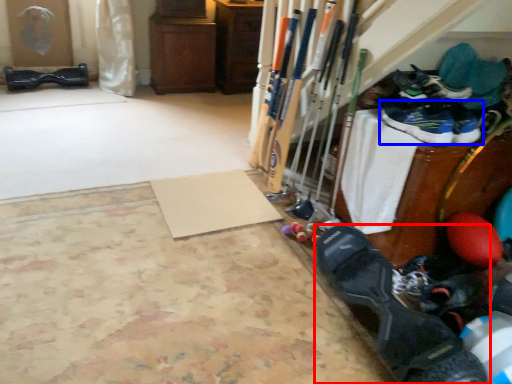
Question: Which object appears closest to the camera in this image, footwear (highlighted by a red box) or footwear (highlighted by a blue box)?

Choices:
 (A) footwear
 (B) footwear

Answer: (A)